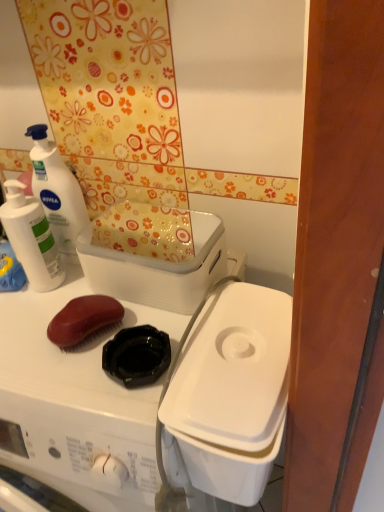
Question: From the image's perspective, is white matte lotion at upper left, the second cleaning product viewed from the left, beneath white plastic container at center-right, which is counted as the 2th appliance, starting from the top?

Choices:
 (A) yes
 (B) no

Answer: (B)

Question: Is white matte lotion at upper left, the second cleaning product viewed from the left, at the left side of white plastic container at center-right, the 1th appliance when ordered from bottom to top?

Choices:
 (A) no
 (B) yes

Answer: (B)

Question: Is white matte lotion at upper left, which appears as the 1th cleaning product when viewed from the right, far from white plastic container at center-right, the 1th appliance when ordered from bottom to top?

Choices:
 (A) no
 (B) yes

Answer: (A)

Question: Is white matte lotion at upper left, which appears as the 1th cleaning product when viewed from the right, outside white plastic container at center-right, the 1th appliance when ordered from bottom to top?

Choices:
 (A) yes
 (B) no

Answer: (A)

Question: From a real-world perspective, is white matte lotion at upper left, the second cleaning product viewed from the left, under white plastic container at center-right, the 1th appliance when ordered from bottom to top?

Choices:
 (A) no
 (B) yes

Answer: (A)

Question: Can you confirm if white matte lotion at upper left, the second cleaning product viewed from the left, is wider than white plastic container at center-right, which is counted as the 2th appliance, starting from the top?

Choices:
 (A) no
 (B) yes

Answer: (A)

Question: Is white plastic container at upper center, which is the first appliance in top-to-bottom order, surrounded by white plastic washing machine at upper left?

Choices:
 (A) yes
 (B) no

Answer: (B)

Question: Is white plastic washing machine at upper left to the right of white plastic container at upper center, which is the 2th appliance in bottom-to-top order, from the viewer's perspective?

Choices:
 (A) no
 (B) yes

Answer: (A)

Question: Is white plastic washing machine at upper left positioned behind white plastic container at upper center, which is the 2th appliance in bottom-to-top order?

Choices:
 (A) no
 (B) yes

Answer: (A)

Question: Can you confirm if white plastic washing machine at upper left is bigger than white plastic container at upper center, which is the first appliance in top-to-bottom order?

Choices:
 (A) no
 (B) yes

Answer: (B)

Question: Is white plastic washing machine at upper left outside of white plastic container at upper center, which is the 2th appliance in bottom-to-top order?

Choices:
 (A) yes
 (B) no

Answer: (A)

Question: From a real-world perspective, is white plastic washing machine at upper left over white plastic container at upper center, which is the first appliance in top-to-bottom order?

Choices:
 (A) no
 (B) yes

Answer: (A)

Question: Considering the relative positions of white plastic container at center-right, which is counted as the 2th appliance, starting from the top, and white matte lotion at upper left, which appears as the 1th cleaning product when viewed from the right, in the image provided, is white plastic container at center-right, which is counted as the 2th appliance, starting from the top, behind white matte lotion at upper left, which appears as the 1th cleaning product when viewed from the right,?

Choices:
 (A) no
 (B) yes

Answer: (A)